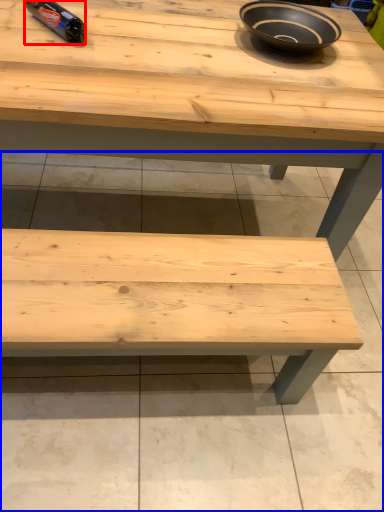
Question: Among these objects, which one is nearest to the camera, bottle (highlighted by a red box) or concrete (highlighted by a blue box)?

Choices:
 (A) bottle
 (B) concrete

Answer: (B)